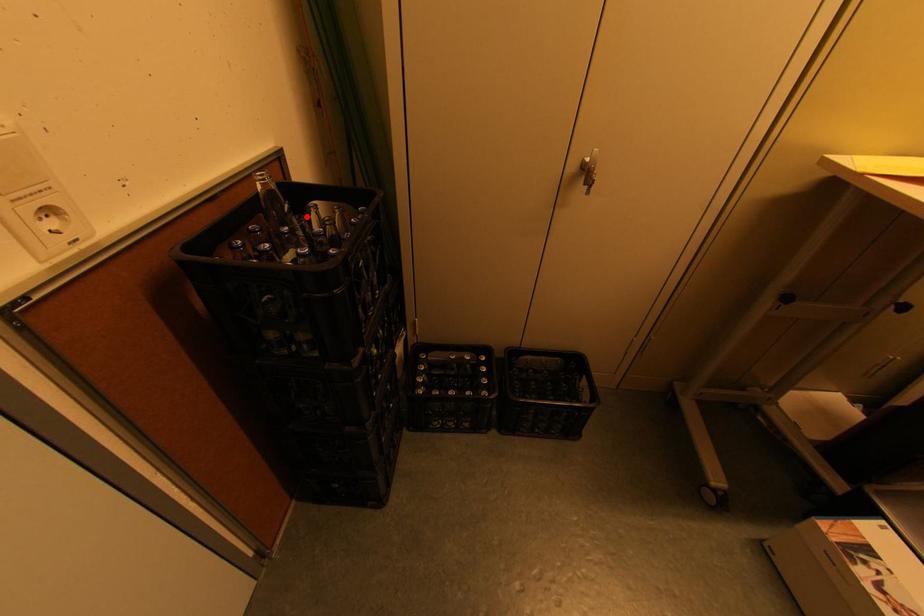
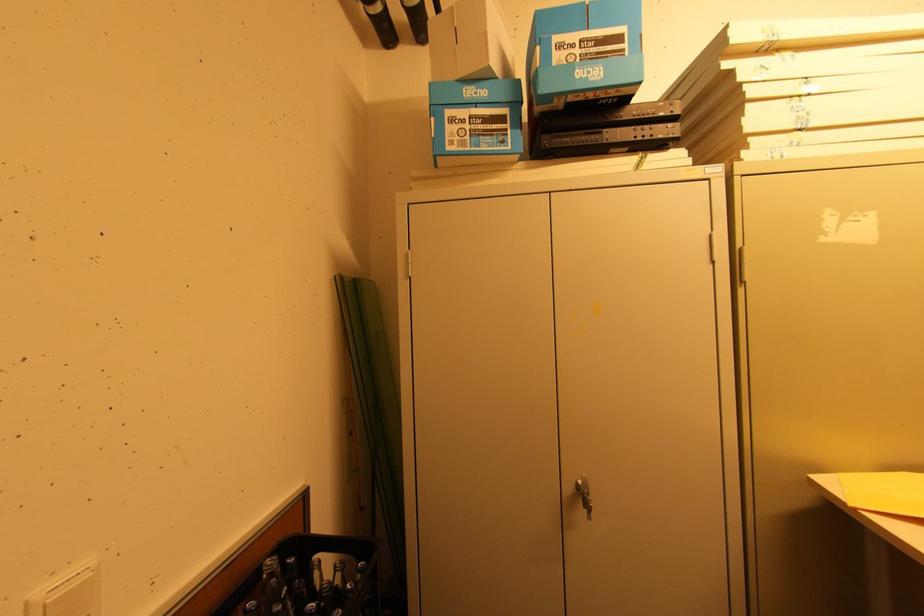
In the second image, find the point that corresponds to the highlighted location in the first image.

(306, 582)